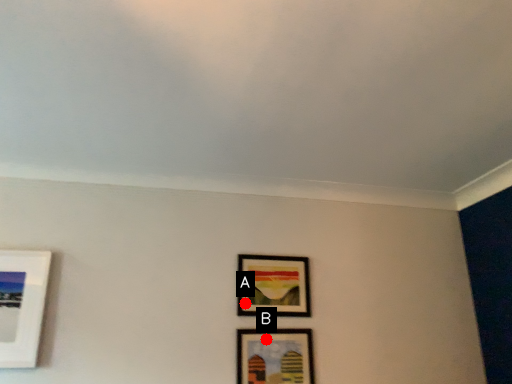
Question: Two points are circled on the image, labeled by A and B beside each circle. Which point is closer to the camera taking this photo?

Choices:
 (A) A is closer
 (B) B is closer

Answer: (B)